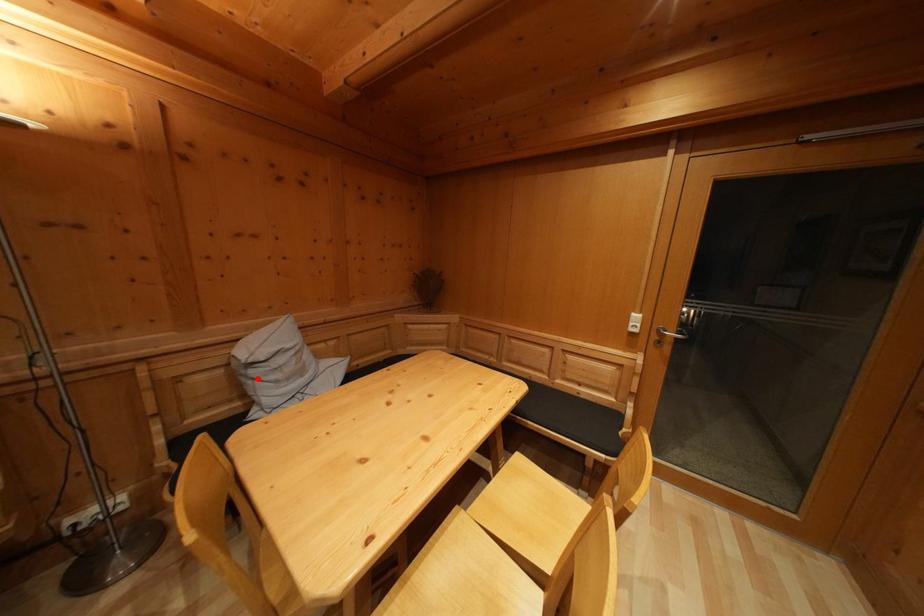
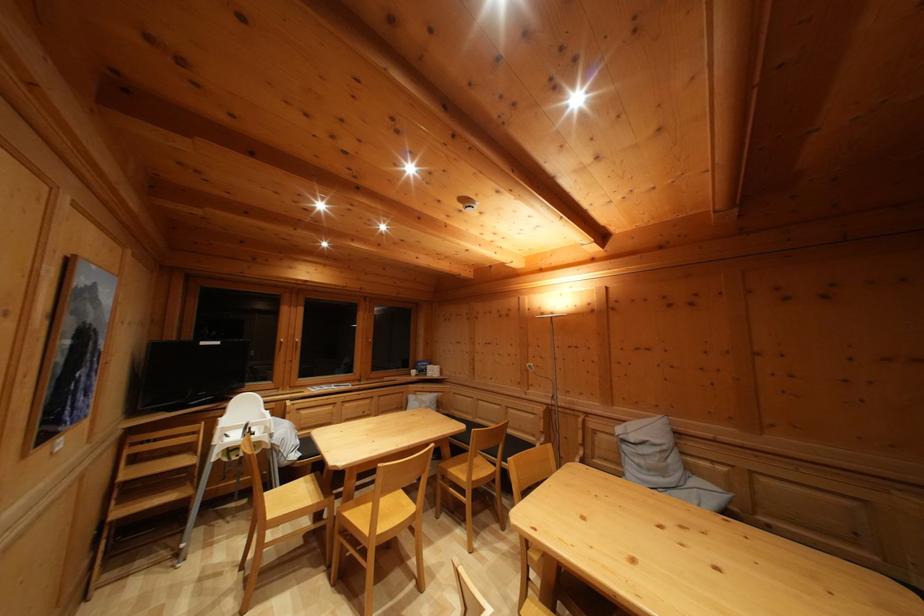
Question: I am providing you with two images of the same scene from different viewpoints. In image1, a red point is highlighted. Considering the same 3D point in image2, which of the following is correct?

Choices:
 (A) It is closer
 (B) It is farther

Answer: (B)